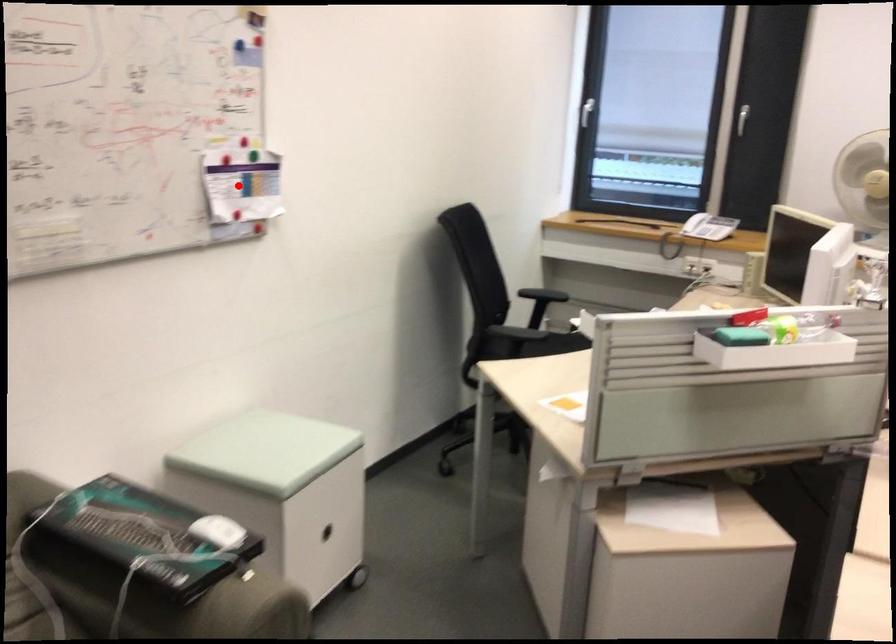
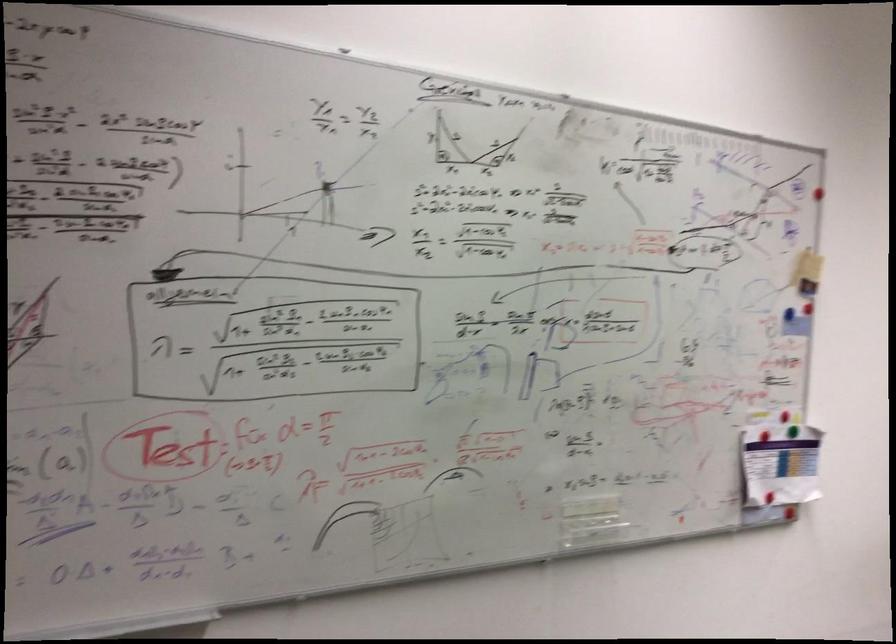
Question: I am providing you with two images of the same scene from different viewpoints. In image1, a red point is highlighted. Considering the same 3D point in image2, which of the following is correct?

Choices:
 (A) It is closer
 (B) It is farther

Answer: (A)